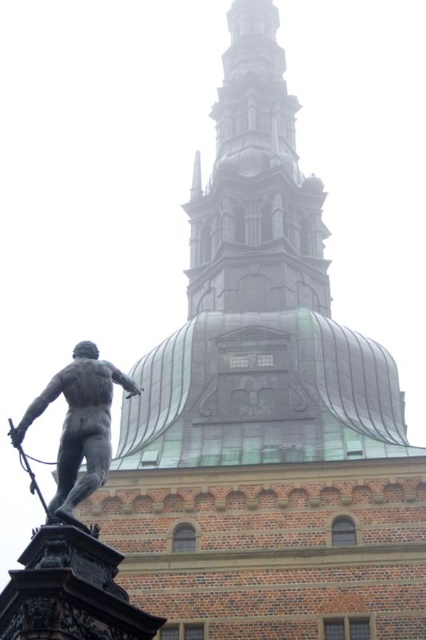
From the picture: You are an architect designing a new plaza and need to ensure the statue will fit under the dome. Based on the image, can you determine if the polished bronze statue at center will fit under the green copper dome at upper center?

The green copper dome at upper center might be wider than the polished bronze statue at center, so there is a possibility that the statue will fit under the dome. However, without exact measurements, this is uncertain.

In the scene shown: You are an architect analyzing the proportions of the building and statue in the image. Which object, the green copper dome at upper center or the polished bronze statue at center, has a greater visual prominence in terms of size?

The green copper dome at upper center is larger in size than the polished bronze statue at center, making it more visually prominent in terms of size.